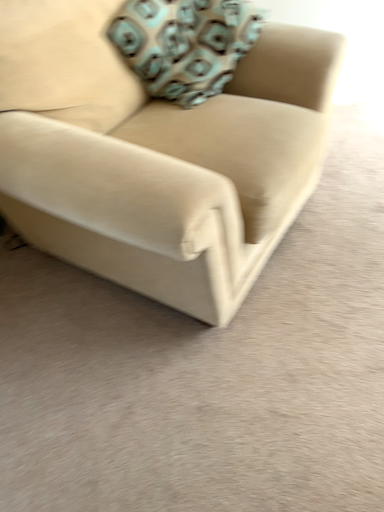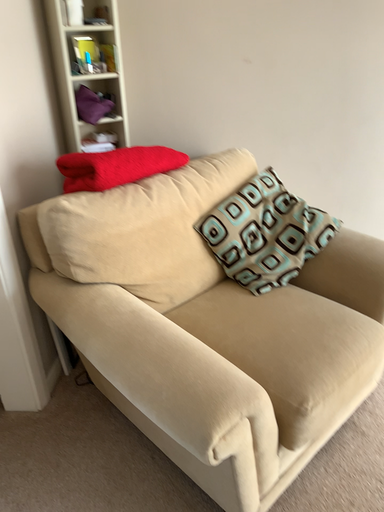
Question: How did the camera likely rotate when shooting the video?

Choices:
 (A) rotated right
 (B) rotated left

Answer: (B)